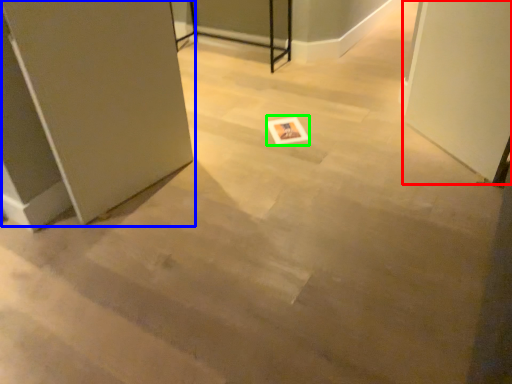
Question: Which object is positioned farthest from screen door (highlighted by a red box)? Select from door (highlighted by a blue box) and postcard (highlighted by a green box).

Choices:
 (A) door
 (B) postcard

Answer: (A)